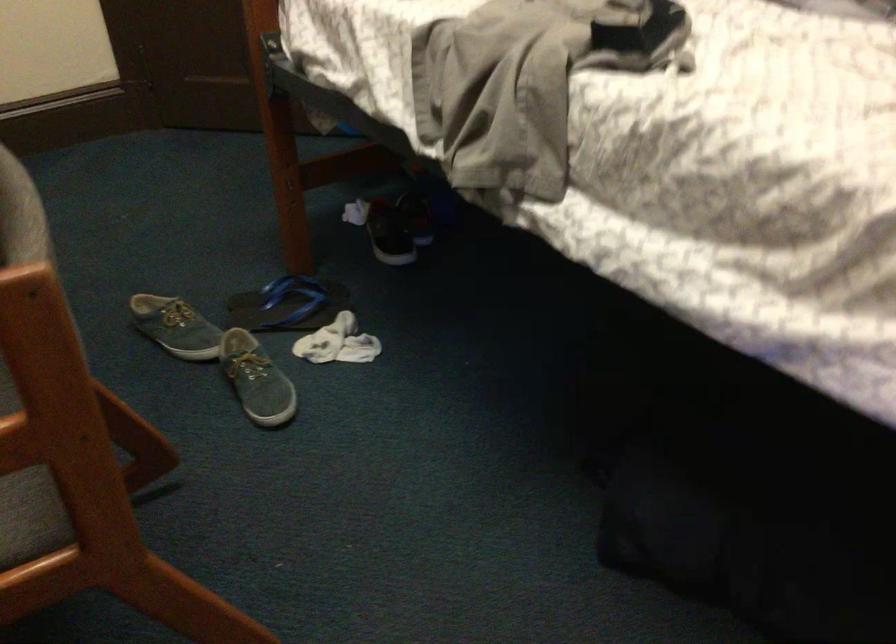
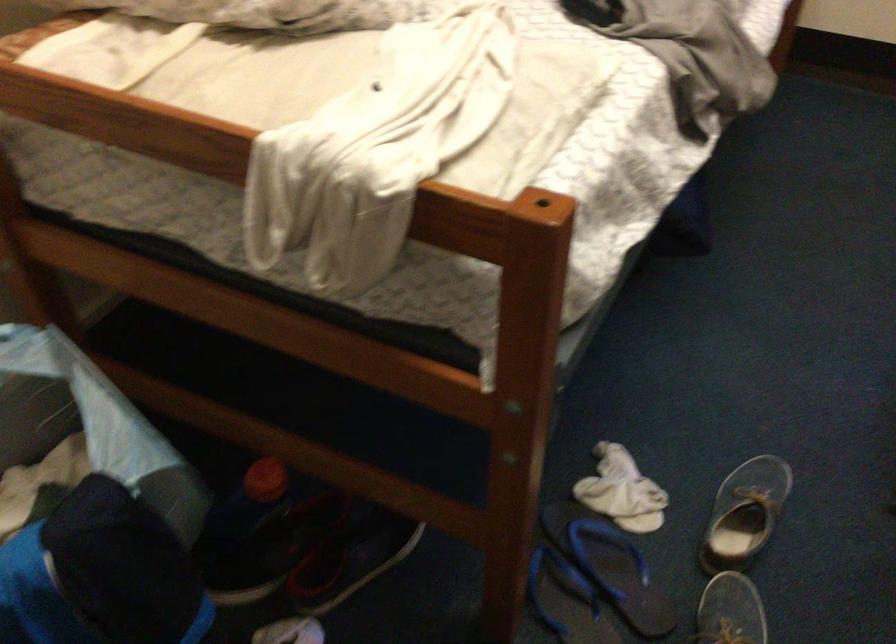
Where in the second image is the point corresponding to [330,339] from the first image?

(622, 491)